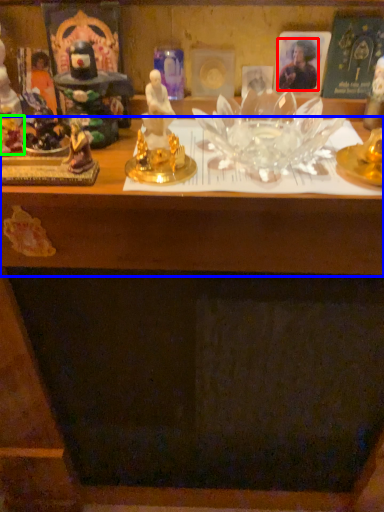
Question: Which is nearer to the person (highlighted by a red box)? table (highlighted by a blue box) or toy (highlighted by a green box).

Choices:
 (A) table
 (B) toy

Answer: (A)